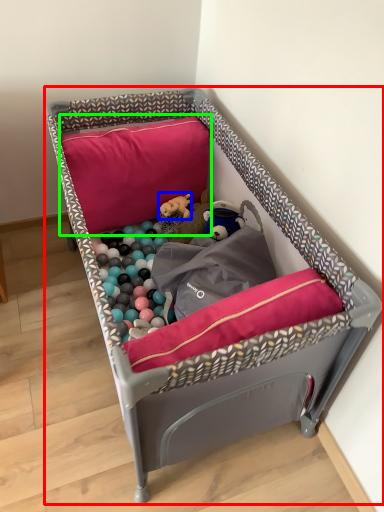
Question: Based on their relative distances, which object is farther from infant bed (highlighted by a red box)? Choose from toy (highlighted by a blue box) and pillow (highlighted by a green box).

Choices:
 (A) toy
 (B) pillow

Answer: (A)